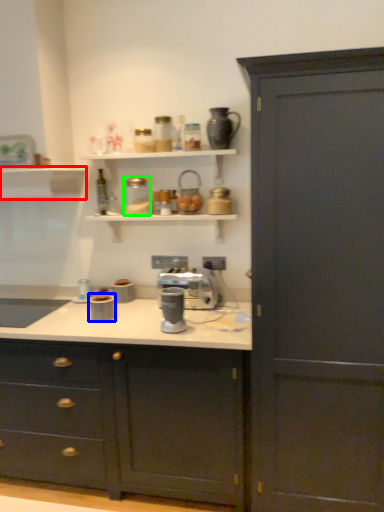
Question: Which object is the closest to the shelf (highlighted by a red box)? Choose among these: appliance (highlighted by a blue box) or appliance (highlighted by a green box).

Choices:
 (A) appliance
 (B) appliance

Answer: (B)